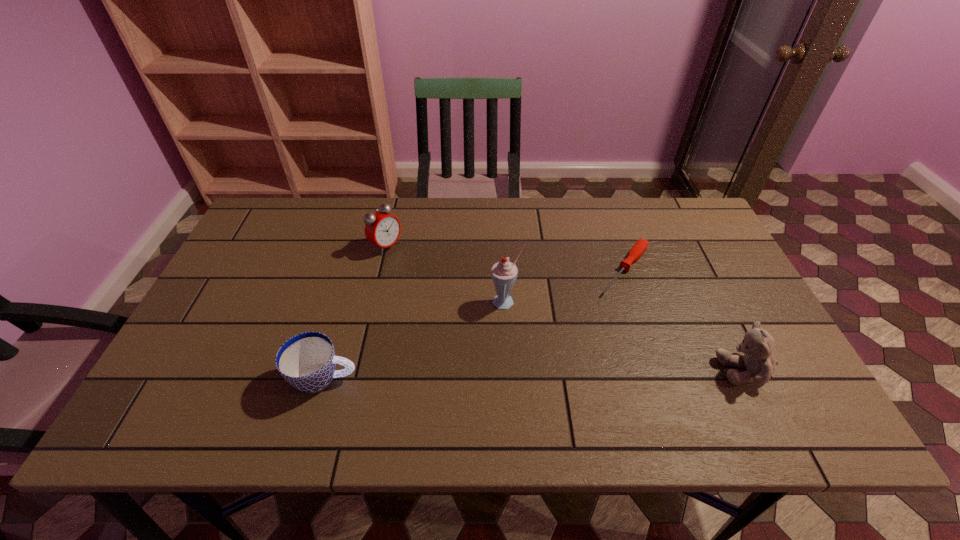
I want to click on free space on the desktop that is between the cup and the rightmost object and is positioned on the straw side of the tallest object, so click(x=534, y=374).

Where is `free space on the desktop that is between the cup and the teddy bear and is positioned at the tip of the fourth object from left to right`? The height and width of the screenshot is (540, 960). free space on the desktop that is between the cup and the teddy bear and is positioned at the tip of the fourth object from left to right is located at coordinates (541, 374).

Image resolution: width=960 pixels, height=540 pixels. Identify the location of vacant space on the desktop that is between the cup and the rightmost object and is positioned on the front-facing side of the alarm clock. (595, 373).